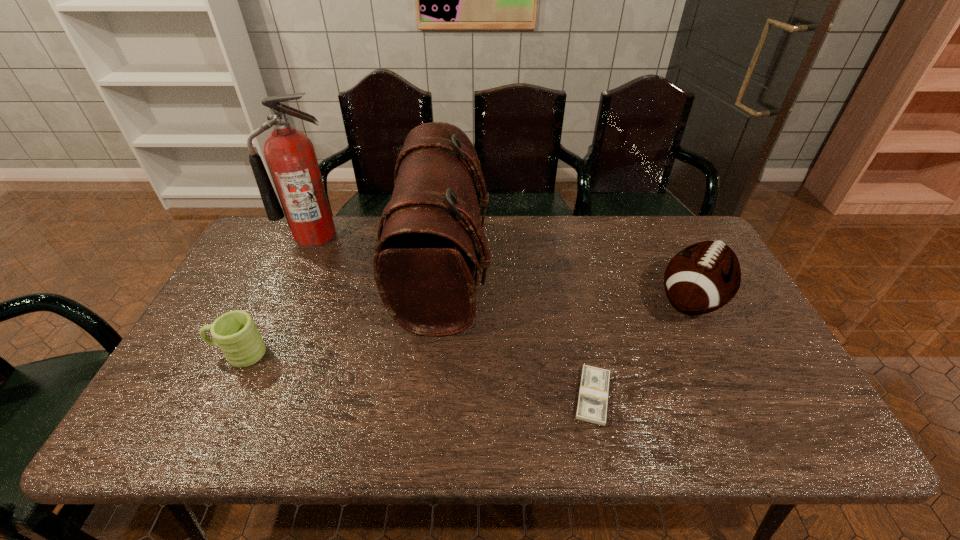
This screenshot has width=960, height=540. Find the location of `free space located 0.240m on the back of the rightmost object`. free space located 0.240m on the back of the rightmost object is located at coordinates (655, 225).

Locate an element on the screen. This screenshot has height=540, width=960. free space located on the back of the dollar is located at coordinates (583, 348).

Locate an element on the screen. This screenshot has width=960, height=540. fire extinguisher present at the far edge is located at coordinates (290, 155).

Locate an element on the screen. This screenshot has width=960, height=540. satchel at the far edge is located at coordinates (424, 264).

Locate an element on the screen. The image size is (960, 540). object that is at the near edge is located at coordinates (593, 394).

Where is `fire extinguisher that is at the left edge`? Image resolution: width=960 pixels, height=540 pixels. fire extinguisher that is at the left edge is located at coordinates (290, 155).

I want to click on mug located in the left edge section of the desktop, so click(x=235, y=333).

Find the location of a particular element. This screenshot has height=540, width=960. object that is at the right edge is located at coordinates (703, 277).

The width and height of the screenshot is (960, 540). What are the coordinates of `object present at the far left corner` in the screenshot? It's located at (290, 155).

You are a GUI agent. You are given a task and a screenshot of the screen. Output one action in this format:
    pyautogui.click(x=<x>, y=<y>)
    Task: Click on the blank area at the far edge
    
    Given the screenshot: What is the action you would take?
    pyautogui.click(x=622, y=225)